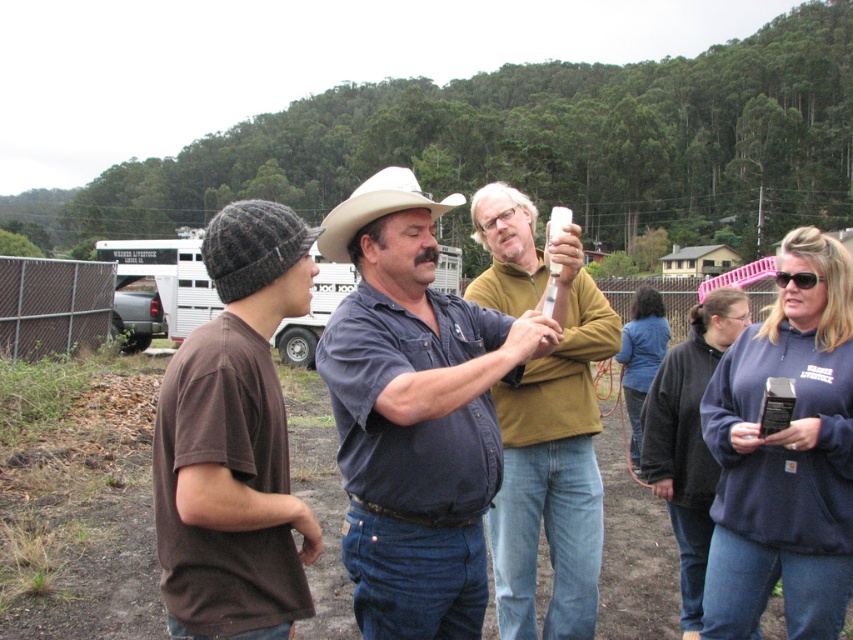
You are a photographer trying to capture a group photo of the blue denim jeans at center and the brown knit beanie at left. If you want to ensure both are fully visible in the frame, which object should you focus on first?

The blue denim jeans at center has a lesser height compared to brown knit beanie at left, so you should focus on the brown knit beanie at left first to ensure both are fully visible in the frame.

You are a photographer trying to capture a candid shot of the blue denim jeans at center and the matte yellow shirt at center. Since you want both subjects to be in focus, which one should you focus on first to ensure the other is also in focus?

The blue denim jeans at center is in front of the matte yellow shirt at center. To ensure both are in focus, you should focus on the blue denim jeans at center first, as it is closer, allowing the matte yellow shirt at center to be within the depth of field.

You are a tailor measuring clothing items in the image. You need to determine which item, the blue denim jeans at center or the brown knit beanie at left, requires more fabric for a replica. Based on their sizes, which one would need more fabric?

The blue denim jeans at center is larger in size than the brown knit beanie at left, so it would require more fabric for a replica.